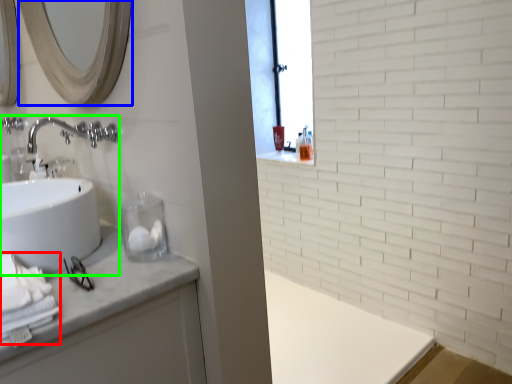
Question: Which object is the farthest from bath towel (highlighted by a red box)? Choose among these: mirror (highlighted by a blue box) or sink (highlighted by a green box).

Choices:
 (A) mirror
 (B) sink

Answer: (A)